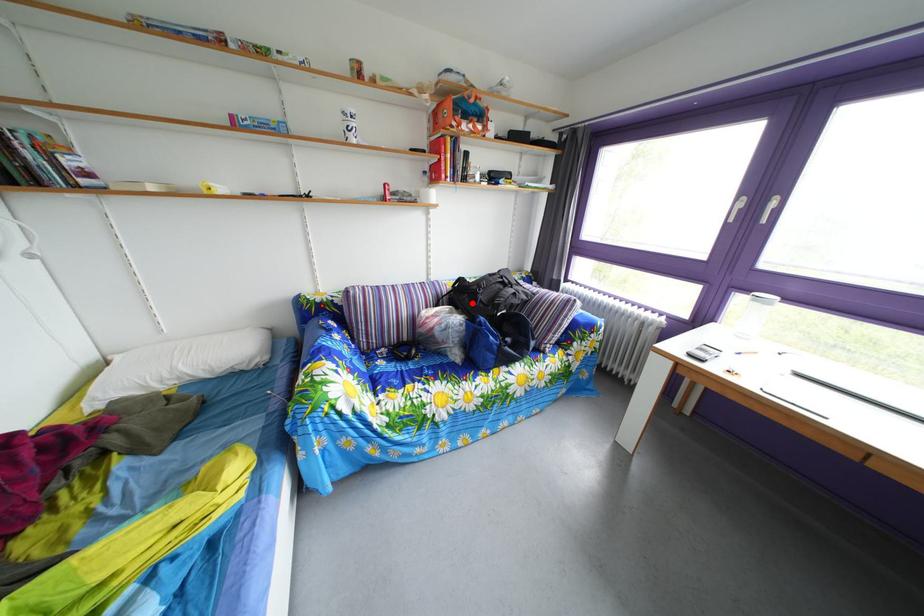
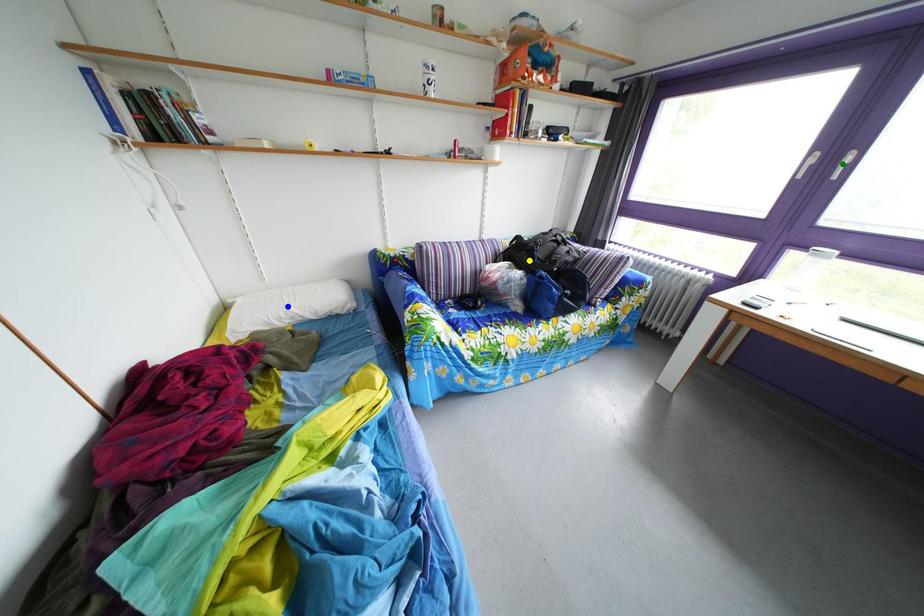
Question: I am providing you with two images of the same scene from different viewpoints. A red point is marked on the first image. You are given multiple points on the second image. Which point in image 2 represents the same 3d spot as the red point in image 1?

Choices:
 (A) yellow point
 (B) green point
 (C) blue point

Answer: (A)